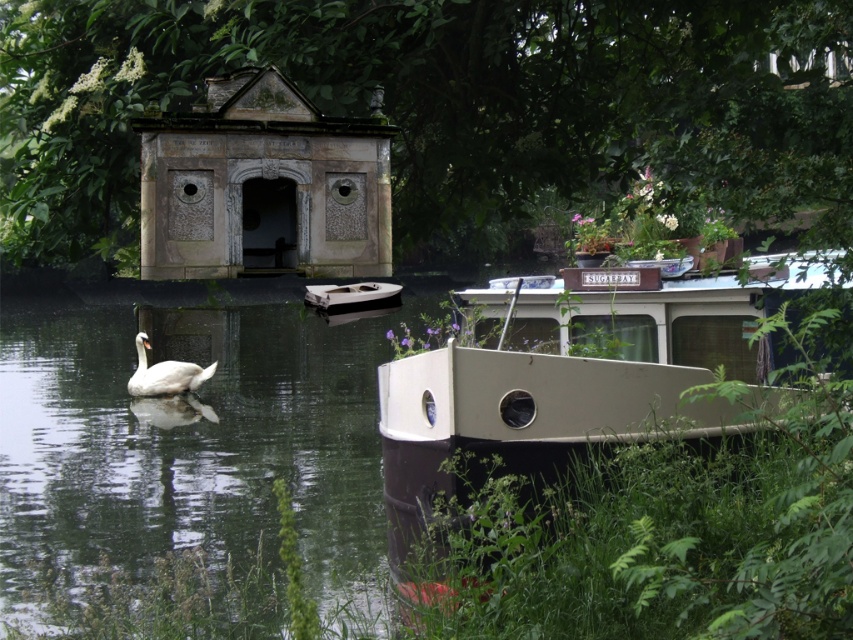
Can you confirm if smooth brown boat at lower right is taller than matte white boat at center?

Correct, smooth brown boat at lower right is much taller as matte white boat at center.

Image resolution: width=853 pixels, height=640 pixels. What do you see at coordinates (193, 436) in the screenshot?
I see `smooth brown boat at lower right` at bounding box center [193, 436].

This screenshot has height=640, width=853. I want to click on smooth brown boat at lower right, so 193,436.

Between smooth brown boat at lower right and white glossy boat at center, which one appears on the right side from the viewer's perspective?

white glossy boat at center is more to the right.

Who is taller, smooth brown boat at lower right or white glossy boat at center?

smooth brown boat at lower right is taller.

Between point (601, 483) and point (334, 300), which one is positioned in front?

Point (601, 483) is more forward.

Where is `smooth brown boat at lower right`? smooth brown boat at lower right is located at coordinates (193, 436).

The image size is (853, 640). What do you see at coordinates (572, 374) in the screenshot?
I see `matte white boat at center` at bounding box center [572, 374].

Can you confirm if matte white boat at center is thinner than white glossy boat at center?

Correct, matte white boat at center's width is less than white glossy boat at center's.

The height and width of the screenshot is (640, 853). Describe the element at coordinates (572, 374) in the screenshot. I see `matte white boat at center` at that location.

This screenshot has height=640, width=853. Identify the location of matte white boat at center. (572, 374).